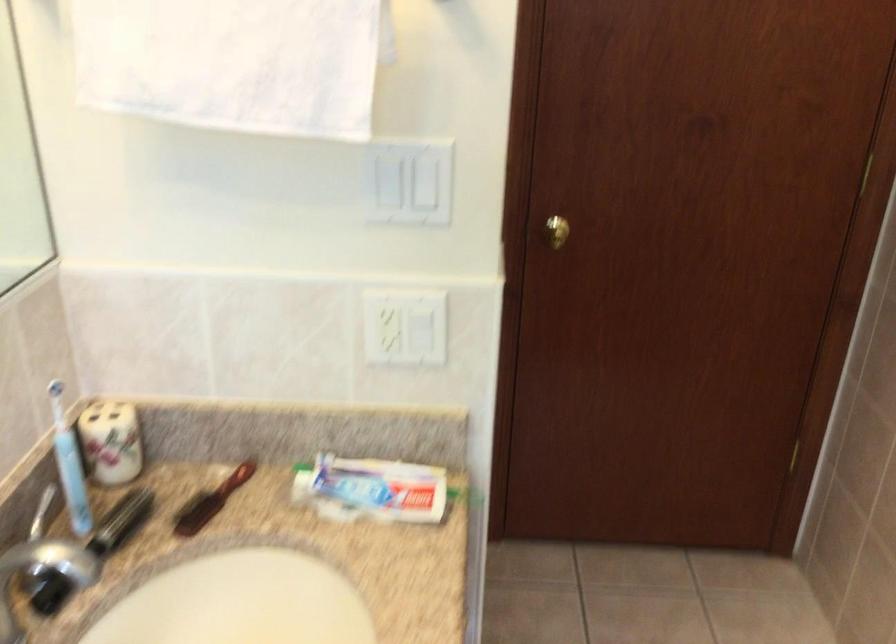
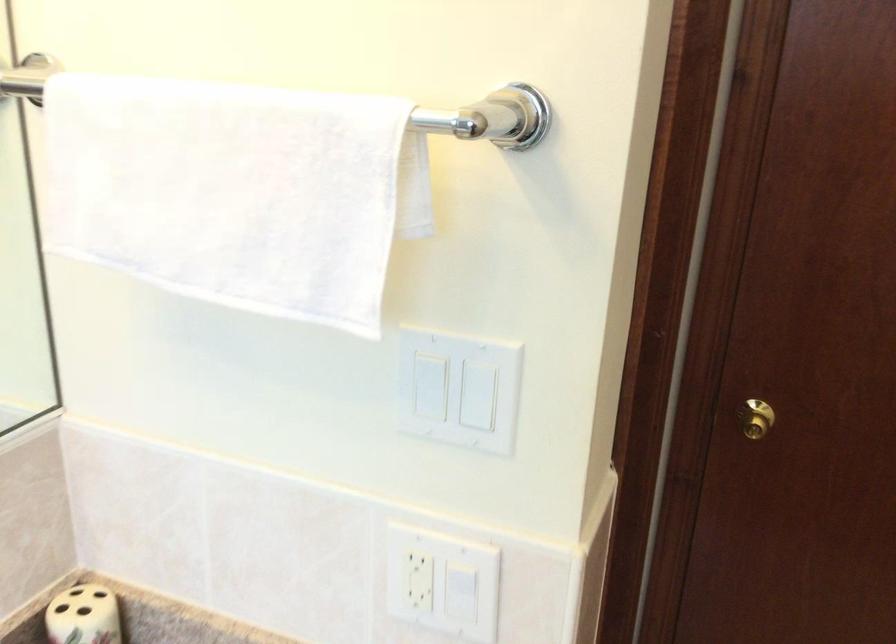
Locate, in the second image, the point that corresponds to (x=383, y=183) in the first image.

(429, 386)